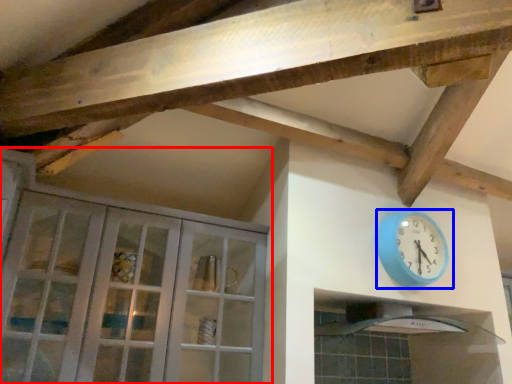
Question: Which point is closer to the camera, cabinetry (highlighted by a red box) or wall clock (highlighted by a blue box)?

Choices:
 (A) cabinetry
 (B) wall clock

Answer: (A)